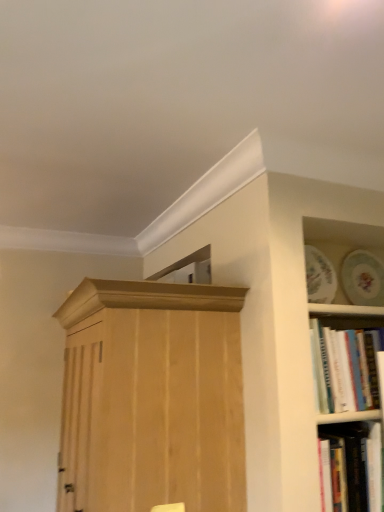
Question: Is hardcover book at lower right, which is the 2th book in top-to-bottom order, at the right side of white paperbacks at right, placed as the first book when sorted from top to bottom?

Choices:
 (A) yes
 (B) no

Answer: (B)

Question: Can you confirm if hardcover book at lower right, marked as the first book in a bottom-to-top arrangement, is wider than white paperbacks at right, the 2th book from the bottom?

Choices:
 (A) yes
 (B) no

Answer: (A)

Question: From a real-world perspective, is hardcover book at lower right, marked as the first book in a bottom-to-top arrangement, below white paperbacks at right, placed as the first book when sorted from top to bottom?

Choices:
 (A) yes
 (B) no

Answer: (A)

Question: Is hardcover book at lower right, which is the 2th book in top-to-bottom order, further to camera compared to white paperbacks at right, placed as the first book when sorted from top to bottom?

Choices:
 (A) yes
 (B) no

Answer: (B)

Question: Can you confirm if hardcover book at lower right, marked as the first book in a bottom-to-top arrangement, is shorter than white paperbacks at right, the 2th book from the bottom?

Choices:
 (A) no
 (B) yes

Answer: (B)

Question: Considering the positions of hardcover book at lower right, marked as the first book in a bottom-to-top arrangement, and white paperbacks at right, the 2th book from the bottom, in the image, is hardcover book at lower right, marked as the first book in a bottom-to-top arrangement, taller or shorter than white paperbacks at right, the 2th book from the bottom,?

Choices:
 (A) tall
 (B) short

Answer: (B)

Question: From the image's perspective, relative to white paperbacks at right, the 2th book from the bottom, is hardcover book at lower right, which is the 2th book in top-to-bottom order, above or below?

Choices:
 (A) below
 (B) above

Answer: (A)

Question: Is hardcover book at lower right, marked as the first book in a bottom-to-top arrangement, bigger or smaller than white paperbacks at right, placed as the first book when sorted from top to bottom?

Choices:
 (A) small
 (B) big

Answer: (B)

Question: Is hardcover book at lower right, which is the 2th book in top-to-bottom order, in front of or behind white paperbacks at right, placed as the first book when sorted from top to bottom, in the image?

Choices:
 (A) front
 (B) behind

Answer: (A)

Question: In terms of size, does natural wood cupboard at center appear bigger or smaller than hardcover book at lower right, which is the 2th book in top-to-bottom order?

Choices:
 (A) big
 (B) small

Answer: (A)

Question: From a real-world perspective, is natural wood cupboard at center above or below hardcover book at lower right, marked as the first book in a bottom-to-top arrangement?

Choices:
 (A) above
 (B) below

Answer: (A)

Question: Considering the relative positions of natural wood cupboard at center and hardcover book at lower right, which is the 2th book in top-to-bottom order, in the image provided, is natural wood cupboard at center to the left or to the right of hardcover book at lower right, which is the 2th book in top-to-bottom order,?

Choices:
 (A) right
 (B) left

Answer: (B)

Question: Considering the positions of point tap(230, 348) and point tap(365, 474), is point tap(230, 348) closer or farther from the camera than point tap(365, 474)?

Choices:
 (A) closer
 (B) farther

Answer: (B)

Question: Is white paperbacks at right, the 2th book from the bottom, taller or shorter than hardcover book at lower right, marked as the first book in a bottom-to-top arrangement?

Choices:
 (A) short
 (B) tall

Answer: (B)

Question: From the image's perspective, is white paperbacks at right, the 2th book from the bottom, located above or below hardcover book at lower right, marked as the first book in a bottom-to-top arrangement?

Choices:
 (A) below
 (B) above

Answer: (B)